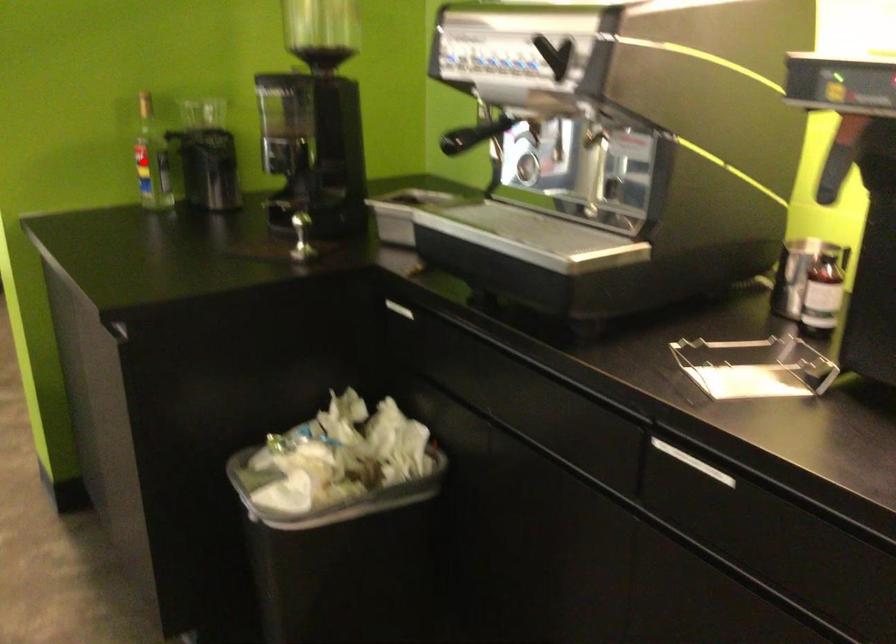
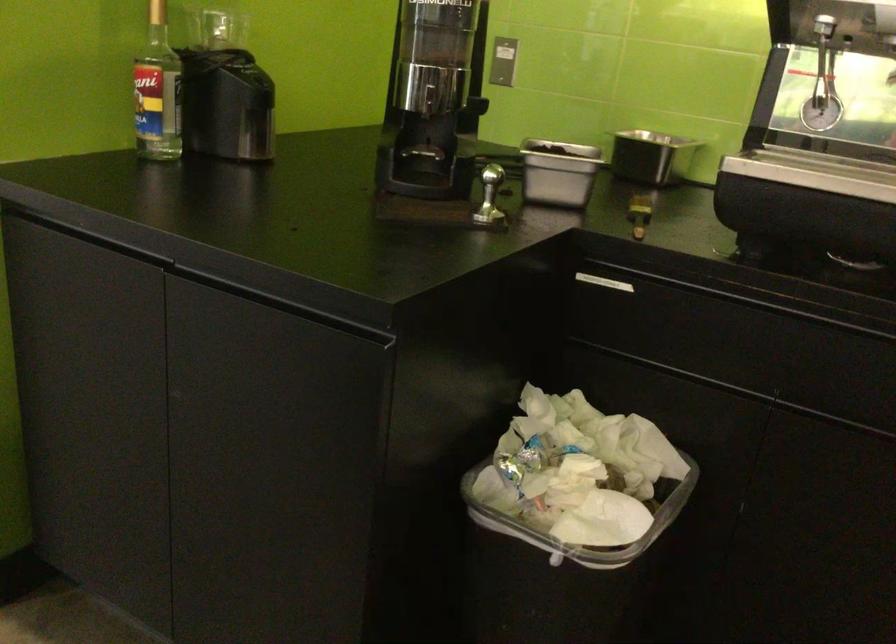
Question: I am providing you with two images of the same scene from different viewpoints. Image1 has a red point marked. In image2, the corresponding 3D location appears at what relative position? Reply with the corresponding letter.

Choices:
 (A) Closer
 (B) Farther

Answer: (A)